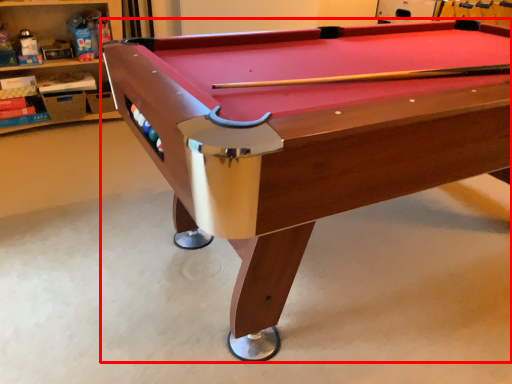
Question: From the image's perspective, where is billiard table (annotated by the red box) located relative to shelf?

Choices:
 (A) below
 (B) above

Answer: (A)